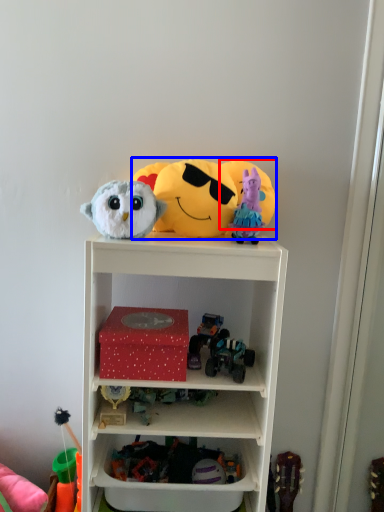
Question: Which object is further to the camera taking this photo, toy (highlighted by a red box) or toy (highlighted by a blue box)?

Choices:
 (A) toy
 (B) toy

Answer: (A)